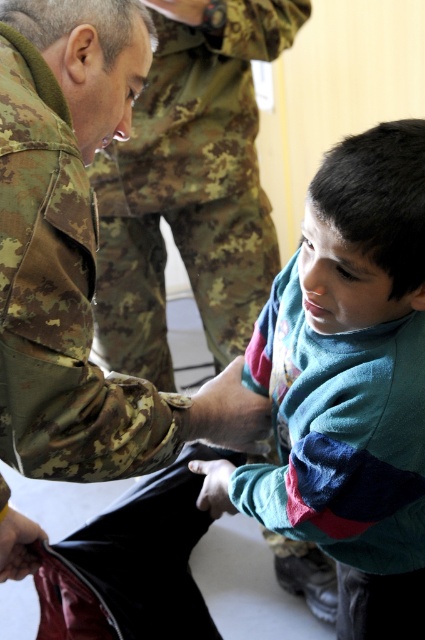
Which is behind, point (422, 401) or point (221, 148)?

The point (221, 148) is behind.

Where is `teal soft sweater at center`? Image resolution: width=425 pixels, height=640 pixels. teal soft sweater at center is located at coordinates (348, 385).

Is point (354, 177) positioned before point (238, 296)?

Yes, point (354, 177) is closer to viewer.

The width and height of the screenshot is (425, 640). I want to click on teal soft sweater at center, so click(x=348, y=385).